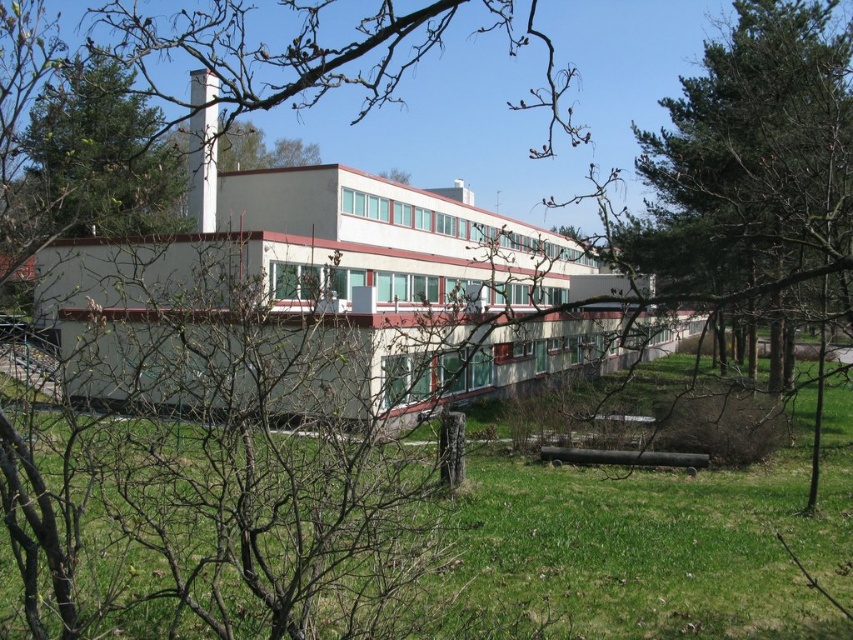
Question: Can you confirm if green leafy tree at upper left is positioned to the right of white smooth chimney at upper center?

Choices:
 (A) no
 (B) yes

Answer: (A)

Question: Does green leafy tree at upper left appear over white smooth chimney at upper center?

Choices:
 (A) yes
 (B) no

Answer: (B)

Question: Does green leafy tree at upper left appear on the left side of white smooth chimney at upper center?

Choices:
 (A) no
 (B) yes

Answer: (B)

Question: Which of the following is the farthest from the observer?

Choices:
 (A) white smooth chimney at upper center
 (B) green leafy tree at upper left

Answer: (B)

Question: Which point is farther to the camera?

Choices:
 (A) green leafy tree at upper left
 (B) white smooth chimney at upper center

Answer: (A)